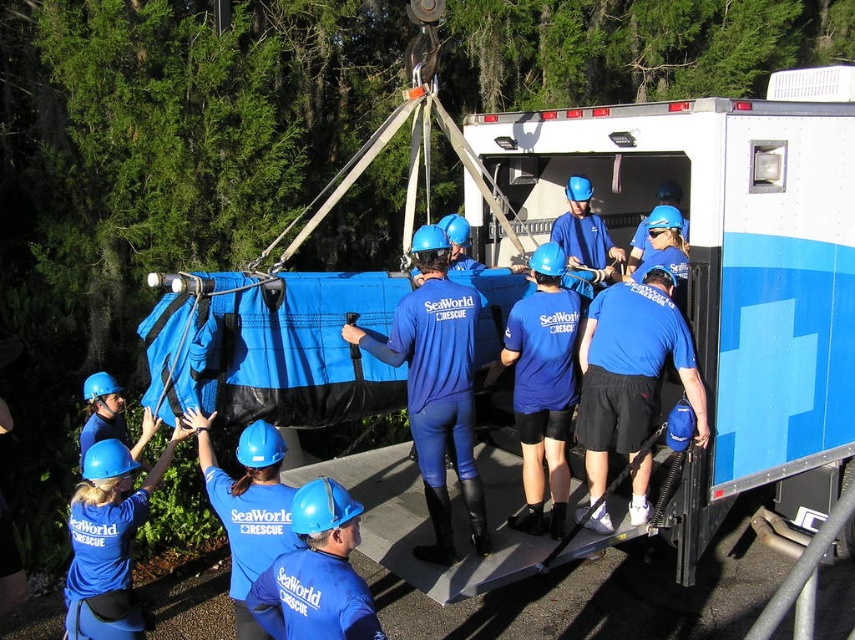
Question: Can you confirm if matte blue helmet at upper left is positioned below blue matte helmet at center?

Choices:
 (A) no
 (B) yes

Answer: (A)

Question: Which point is closer to the camera?

Choices:
 (A) (142, 618)
 (B) (444, 413)
 (C) (605, 387)
 (D) (299, 536)

Answer: (D)

Question: Is matte blue helmet at upper left wider than blue matte helmet at center?

Choices:
 (A) yes
 (B) no

Answer: (B)

Question: Does matte blue wetsuit at center come in front of matte blue helmet at upper left?

Choices:
 (A) no
 (B) yes

Answer: (A)

Question: Which object is the closest to the blue matte helmet at center?

Choices:
 (A) matte blue wetsuit at center
 (B) blue matte shorts at center

Answer: (A)

Question: Which point is farther from the camera taking this photo?

Choices:
 (A) (337, 515)
 (B) (604, 483)
 (C) (419, 552)

Answer: (B)